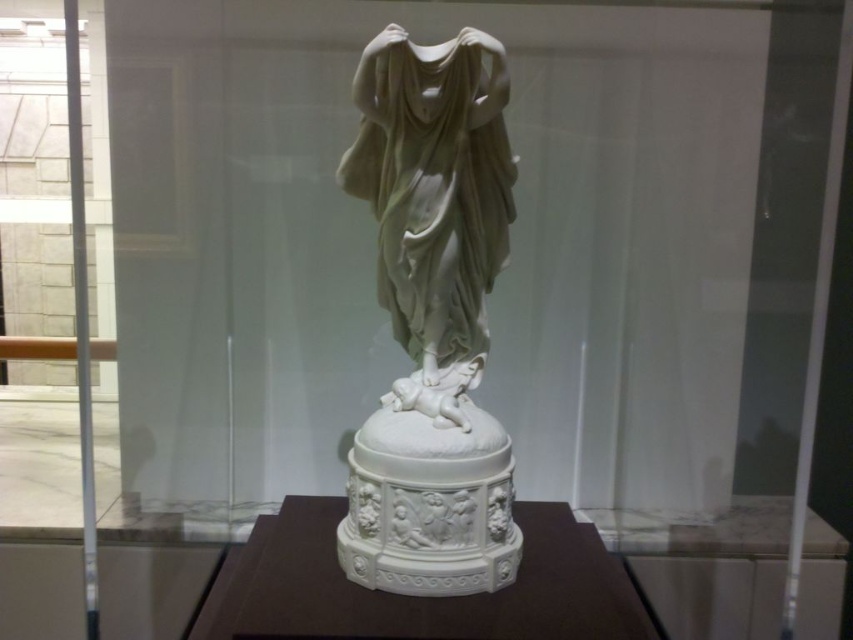
You are an art conservator tasked with moving the white marble statue at center and the white marble base at center to a new exhibition space. The transport crate has a maximum width capacity of 1.2 meters. Given that the statue and base must be placed side by side in the crate, will they fit together?

The white marble statue at center is narrower than the white marble base at center. Since the statue is less wide than the base, the combined width of both items would depend on the base width plus the statue width. However, without specific measurements, we cannot confirm if their total width exceeds 1.2 meters. The answer requires knowing individual widths.

Consider the image. You are a museum curator planning to install a motion sensor to monitor the white marble statue at center. The sensor has a maximum effective range of 1 meter. If the sensor is placed at coordinates point A, which is at position 0.5, 0.5, will it be able to effectively monitor the statue?

The white marble statue at center is located at point [432,317], which is very close to the sensor at [426,320]. The distance between them is less than 1 meter, so the sensor can effectively monitor the statue.

You are a museum visitor standing in front of the glass case. You notice the white marble statue at center and the white marble base at center. Which object is positioned higher up in the scene?

The white marble statue at center is located above the white marble base at center, so it is positioned higher up in the scene.